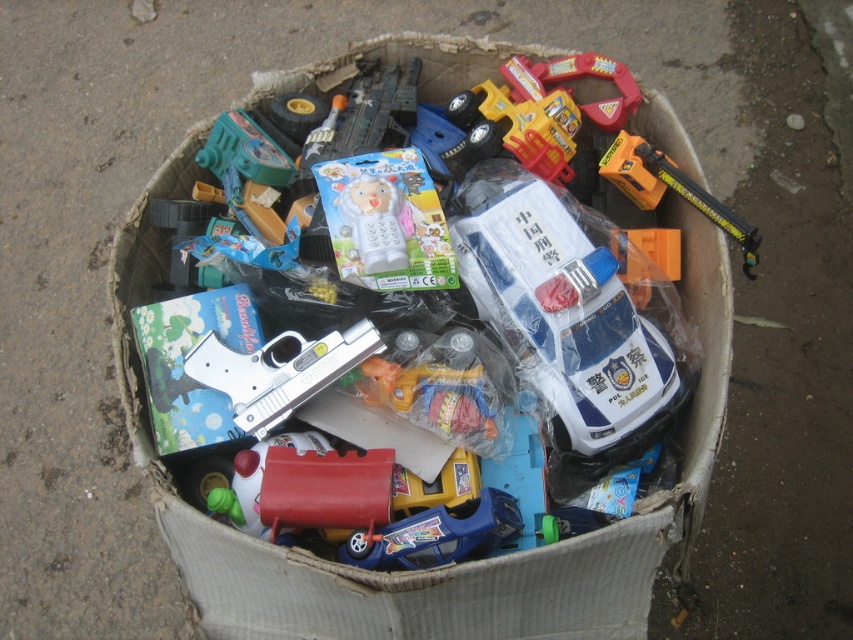
You are a child trying to decide which toy to pick first. You see the white plastic police car at center and the orange plastic toy at upper right. Which one is larger in size?

The white plastic police car at center is bigger than the orange plastic toy at upper right.